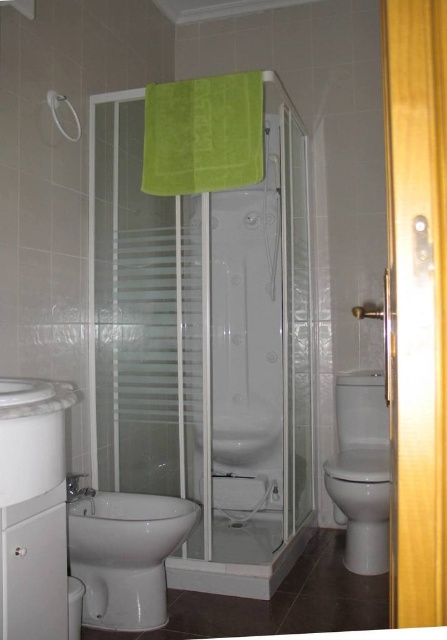
You are standing in the bathroom and want to place a small plant pot. The plant pot has a diameter of 0.2 meters. The coordinates of the available space are at point (202, 134). Can the plant pot fit there?

The point (202, 134) corresponds to the green fabric towel at upper center. Since the towel is already occupying that space, the plant pot cannot be placed there.

You are standing in the bathroom and want to determine which of the two points, point (x=408, y=339) or point (x=152, y=83), is closer to you. Based on the scene description, which point is nearer?

Point (x=408, y=339) is closer to the viewer than point (x=152, y=83).